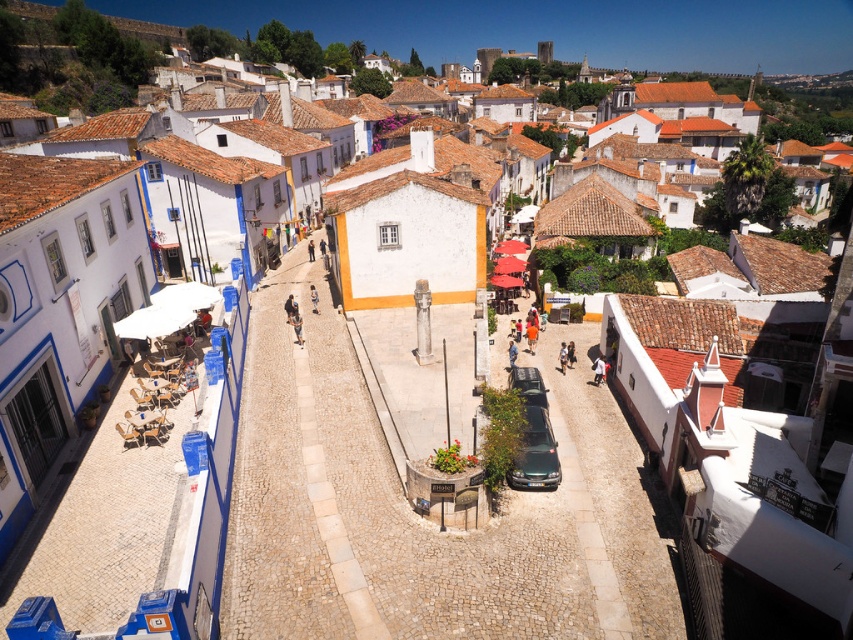
Question: Which point appears farthest from the camera in this image?

Choices:
 (A) (531, 404)
 (B) (531, 404)

Answer: (A)

Question: From the image, what is the correct spatial relationship of metallic green car at center in relation to metallic gray car at center?

Choices:
 (A) above
 (B) below

Answer: (B)

Question: Is metallic green car at center below metallic gray car at center?

Choices:
 (A) yes
 (B) no

Answer: (A)

Question: Is metallic green car at center thinner than metallic gray car at center?

Choices:
 (A) no
 (B) yes

Answer: (A)

Question: Which of the following is the farthest from the observer?

Choices:
 (A) metallic green car at center
 (B) metallic gray car at center

Answer: (B)